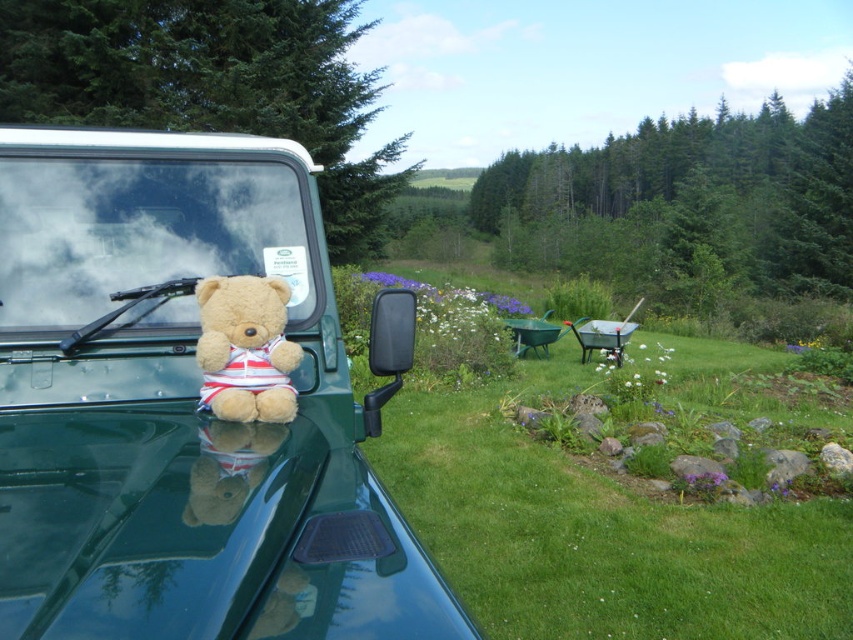
Question: Which object appears farthest from the camera in this image?

Choices:
 (A) fuzzy beige teddy bear at center
 (B) green matte car at center
 (C) transparent glass windshield at upper center

Answer: (C)

Question: Where is green matte car at center located in relation to transparent glass windshield at upper center in the image?

Choices:
 (A) below
 (B) above

Answer: (A)

Question: Which of the following is the farthest from the observer?

Choices:
 (A) transparent glass windshield at upper center
 (B) green matte car at center
 (C) fuzzy beige teddy bear at center

Answer: (A)

Question: Among these objects, which one is nearest to the camera?

Choices:
 (A) transparent glass windshield at upper center
 (B) green matte car at center

Answer: (B)

Question: Is green matte car at center behind fuzzy beige teddy bear at center?

Choices:
 (A) no
 (B) yes

Answer: (A)

Question: Is transparent glass windshield at upper center to the right of fuzzy beige teddy bear at center from the viewer's perspective?

Choices:
 (A) yes
 (B) no

Answer: (B)